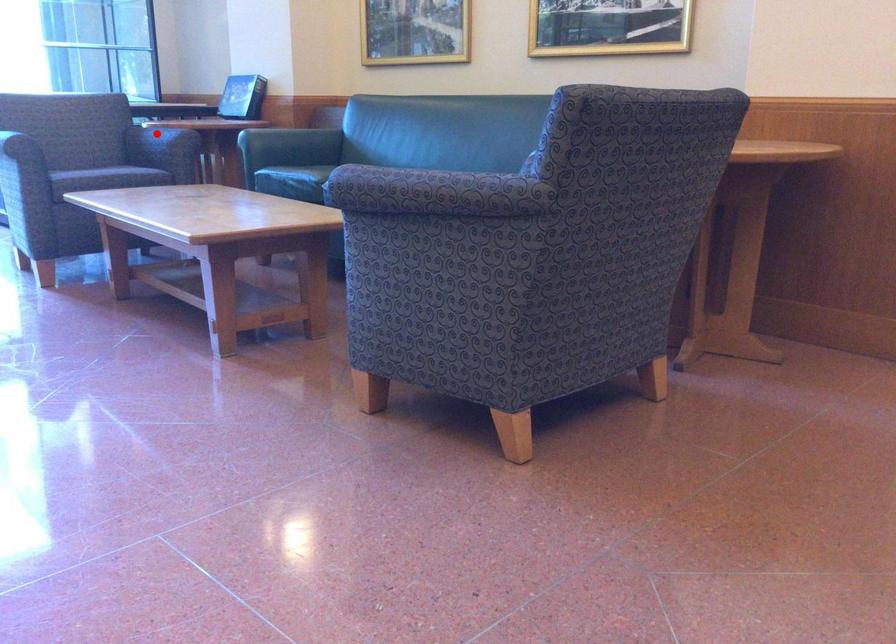
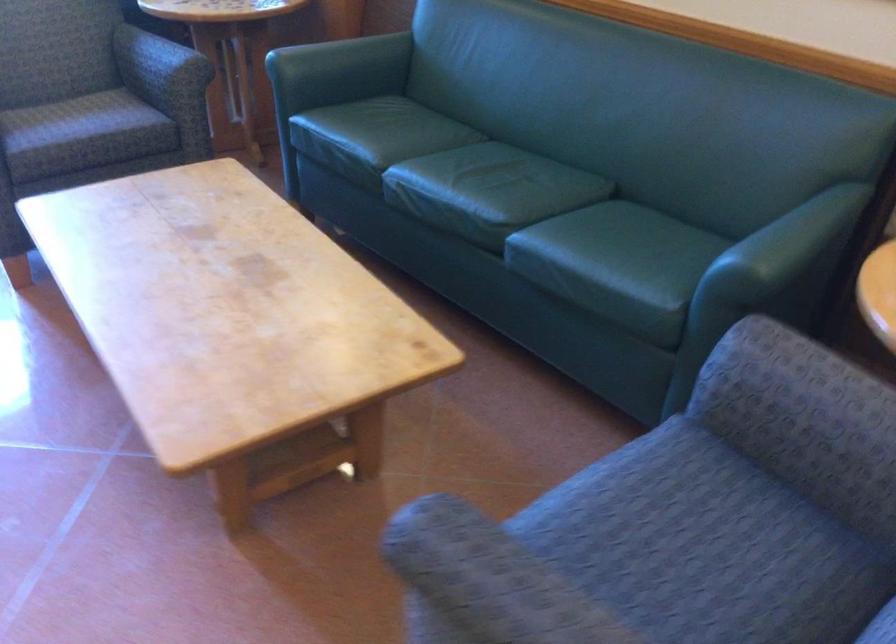
Question: I am providing you with two images of the same scene from different viewpoints. Image1 has a red point marked. In image2, the corresponding 3D location appears at what relative position? Reply with the corresponding letter.

Choices:
 (A) Closer
 (B) Farther

Answer: (A)